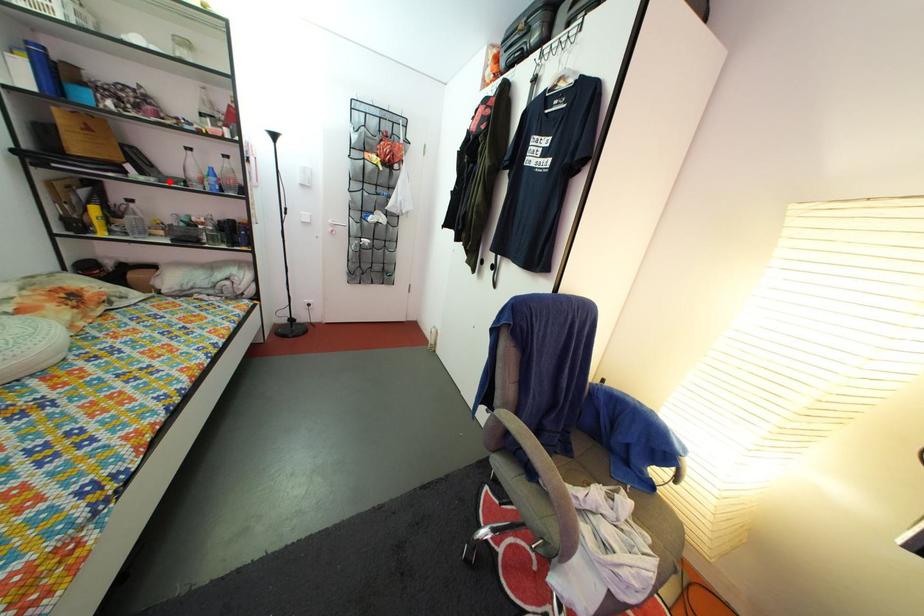
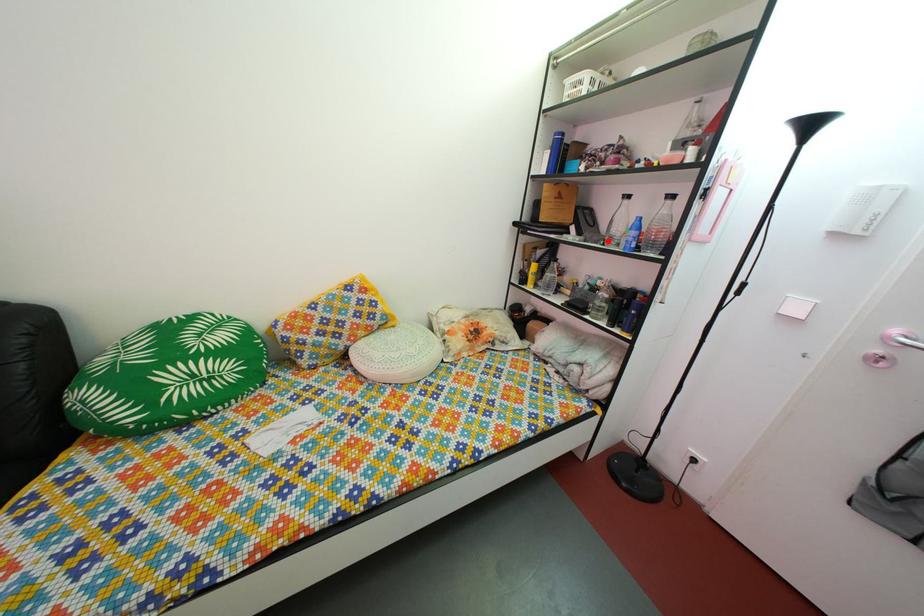
I am providing you with two images of the same scene from different viewpoints. A red point is marked on the first image and another point is marked on the second image. Are the points marked in image1 and image2 representing the same 3D position?

Yes